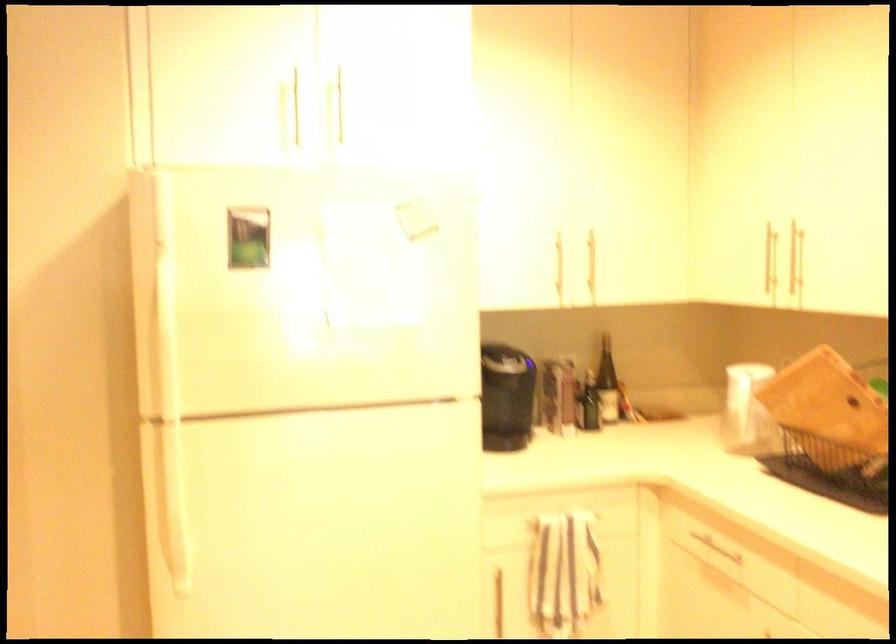
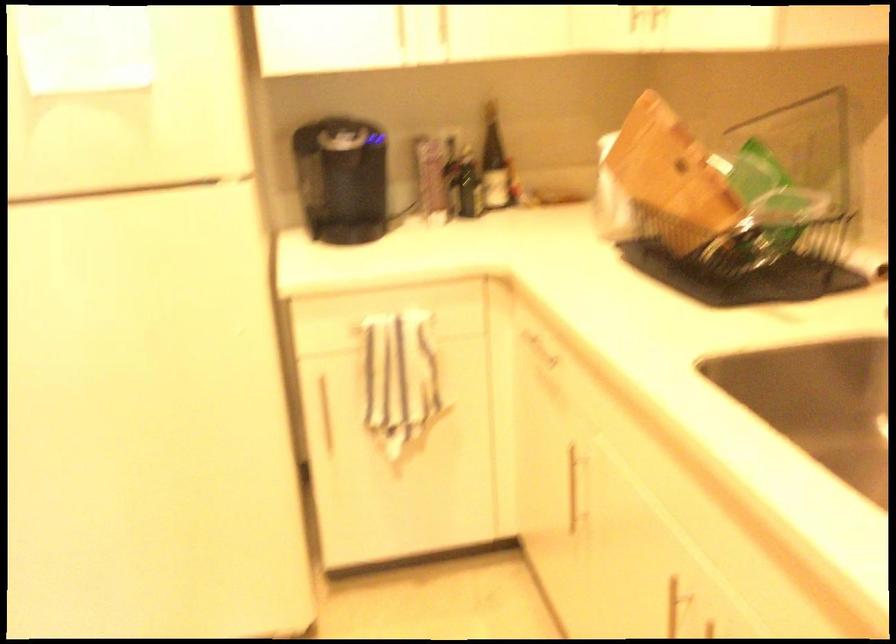
Which direction would the cameraman need to move to produce the second image?

The cameraman moved toward right, forward.